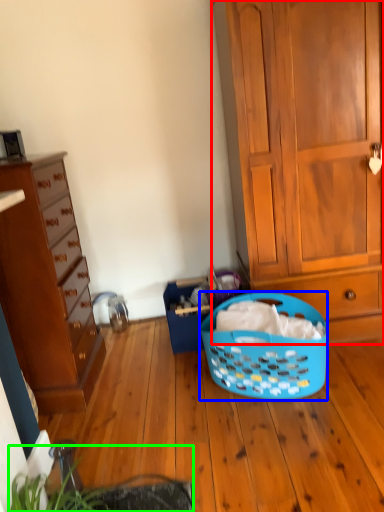
Question: Which object is positioned closest to cabinetry (highlighted by a red box)? Select from picnic basket (highlighted by a blue box) and plant (highlighted by a green box).

Choices:
 (A) picnic basket
 (B) plant

Answer: (A)